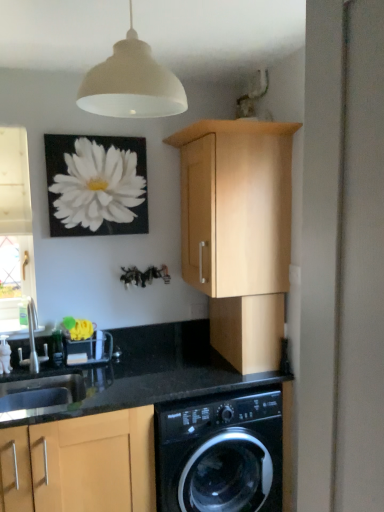
Where is `vacant area situated below silver metallic faucet at lower left (from a real-world perspective)`? The height and width of the screenshot is (512, 384). vacant area situated below silver metallic faucet at lower left (from a real-world perspective) is located at coordinates (41, 370).